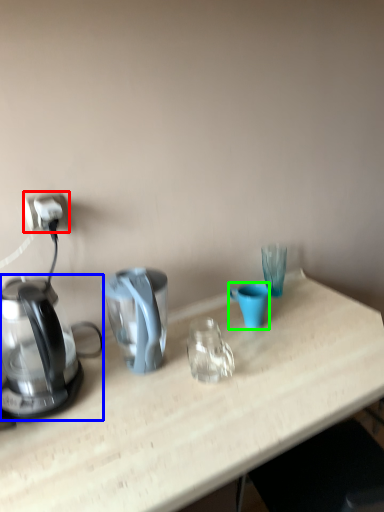
Question: Which is nearer to the power outlet (highlighted by a red box)? kettle (highlighted by a blue box) or coffee cup (highlighted by a green box).

Choices:
 (A) kettle
 (B) coffee cup

Answer: (A)